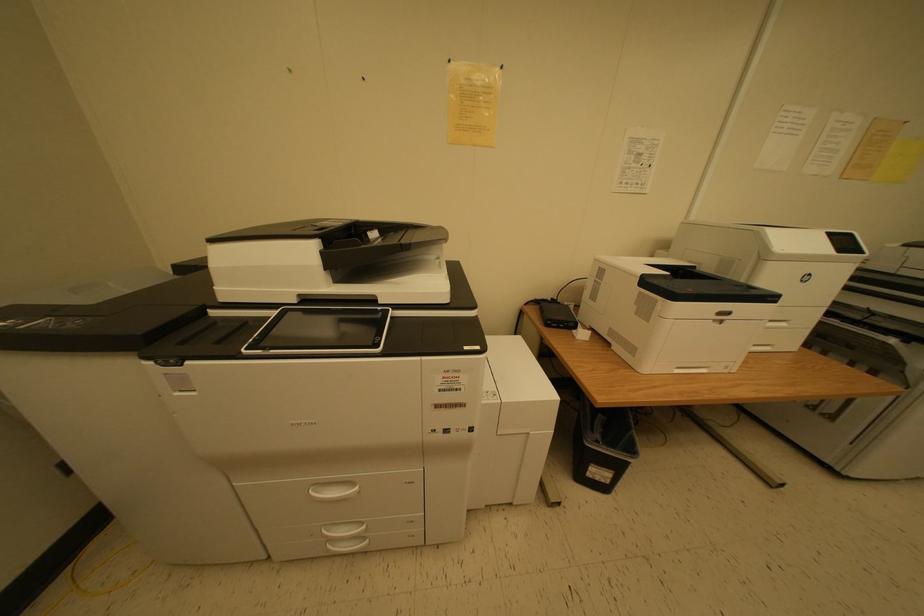
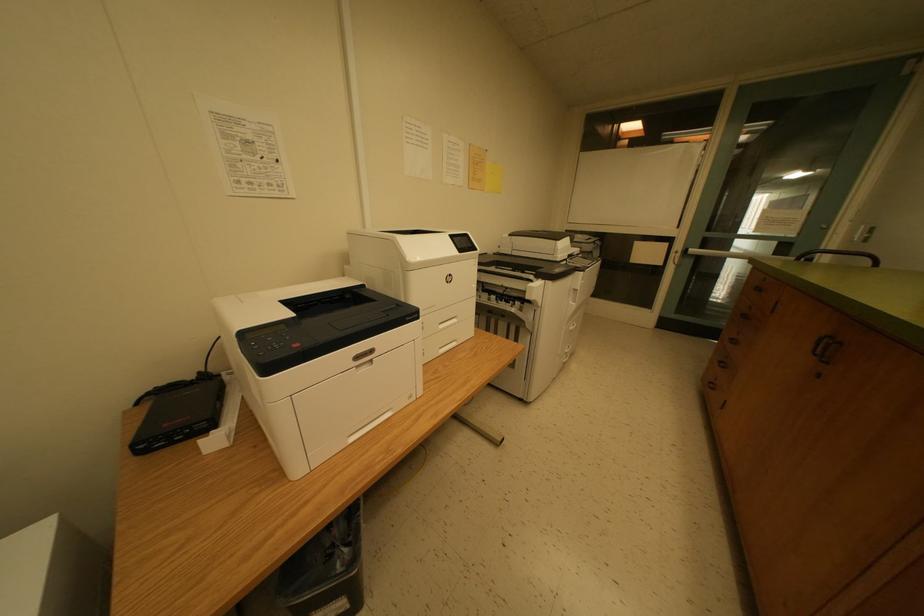
Question: The camera is either moving clockwise (left) or counter-clockwise (right) around the object. The first image is from the beginning of the video and the second image is from the end. Is the camera moving left or right when shooting the video?

Choices:
 (A) Left
 (B) Right

Answer: (A)